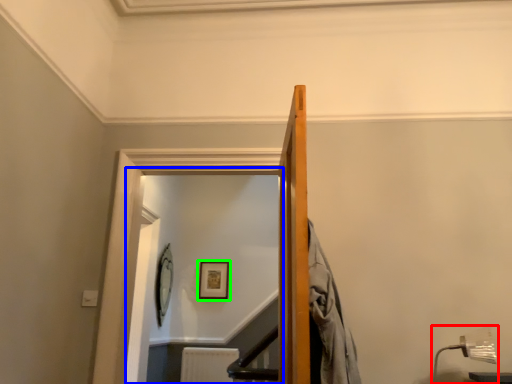
Question: Based on their relative distances, which object is farther from lamp (highlighted by a red box)? Choose from glass door (highlighted by a blue box) and picture frame (highlighted by a green box).

Choices:
 (A) glass door
 (B) picture frame

Answer: (B)